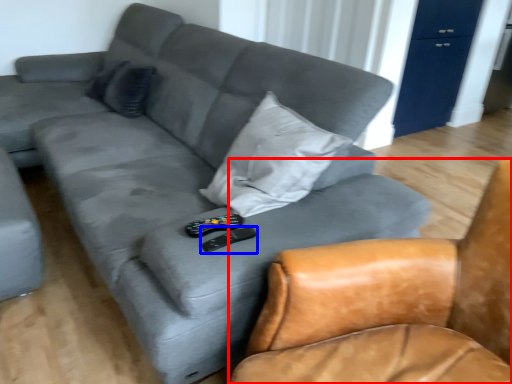
Question: Which of the following is the farthest to the observer, chair (highlighted by a red box) or remote (highlighted by a blue box)?

Choices:
 (A) chair
 (B) remote

Answer: (B)